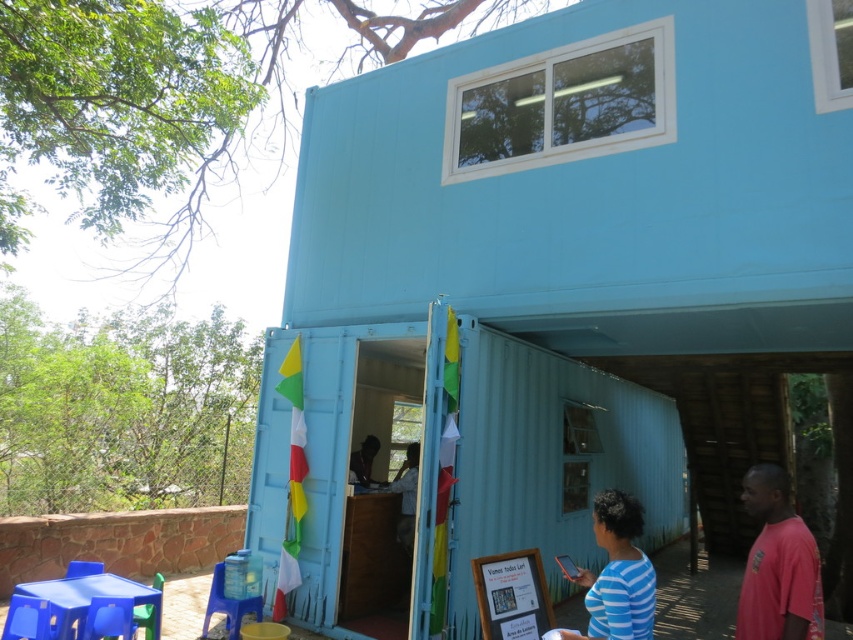
Between light blue corrugated metal container at center and matte black man at center, which one has less height?

matte black man at center

Who is more distant from viewer, (590, 141) or (364, 449)?

Positioned behind is point (364, 449).

Who is more forward, (548, 512) or (358, 488)?

Point (358, 488) is more forward.

Find the location of a particular element. light blue corrugated metal container at center is located at coordinates (556, 289).

Between matte pink t-shirt at lower right and matte black man at center, which one appears on the right side from the viewer's perspective?

From the viewer's perspective, matte pink t-shirt at lower right appears more on the right side.

Is matte pink t-shirt at lower right positioned at the back of matte black man at center?

That is False.

The width and height of the screenshot is (853, 640). Describe the element at coordinates (778, 564) in the screenshot. I see `matte pink t-shirt at lower right` at that location.

Identify the location of matte pink t-shirt at lower right. (778, 564).

Can you confirm if matte pink t-shirt at lower right is positioned to the right of blue striped shirt at lower center?

Indeed, matte pink t-shirt at lower right is positioned on the right side of blue striped shirt at lower center.

Which is behind, point (776, 499) or point (611, 568)?

Point (776, 499)

The image size is (853, 640). Find the location of `matte pink t-shirt at lower right`. matte pink t-shirt at lower right is located at coordinates (778, 564).